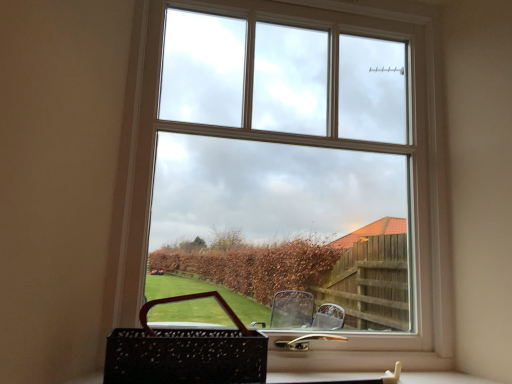
Find the location of `transparent glass window at center`. transparent glass window at center is located at coordinates (292, 165).

The width and height of the screenshot is (512, 384). What do you see at coordinates (292, 165) in the screenshot?
I see `transparent glass window at center` at bounding box center [292, 165].

Locate an element on the screen. transparent glass window at center is located at coordinates (292, 165).